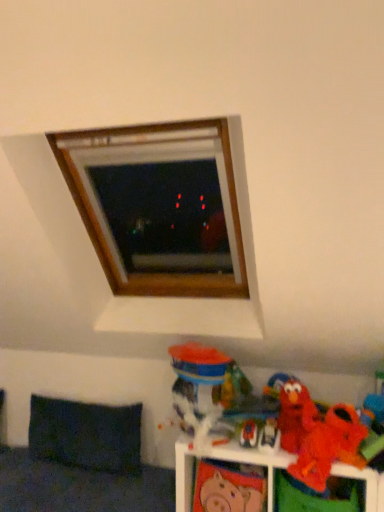
Question: Can you confirm if orange plush toy at lower right, marked as the 1th toy in a right-to-left arrangement, is positioned to the left of matte pink piggy bank at lower center, the sixth toy in the right-to-left sequence?

Choices:
 (A) no
 (B) yes

Answer: (A)

Question: Is orange plush toy at lower right, marked as the 1th toy in a right-to-left arrangement, positioned with its back to matte pink piggy bank at lower center, the sixth toy in the right-to-left sequence?

Choices:
 (A) no
 (B) yes

Answer: (A)

Question: From the image's perspective, is orange plush toy at lower right, placed as the 7th toy when sorted from left to right, under matte pink piggy bank at lower center, acting as the second toy starting from the left?

Choices:
 (A) no
 (B) yes

Answer: (A)

Question: Is orange plush toy at lower right, placed as the 7th toy when sorted from left to right, behind matte pink piggy bank at lower center, acting as the second toy starting from the left?

Choices:
 (A) yes
 (B) no

Answer: (B)

Question: Is orange plush toy at lower right, placed as the 7th toy when sorted from left to right, not inside matte pink piggy bank at lower center, acting as the second toy starting from the left?

Choices:
 (A) no
 (B) yes

Answer: (B)

Question: Is dark fabric pillow at lower left taller or shorter than matte plastic toy at lower right, the 5th toy from the right?

Choices:
 (A) tall
 (B) short

Answer: (A)

Question: Visually, is dark fabric pillow at lower left positioned to the left or to the right of matte plastic toy at lower right, the 5th toy from the right?

Choices:
 (A) right
 (B) left

Answer: (B)

Question: Considering their positions, is dark fabric pillow at lower left located in front of or behind matte plastic toy at lower right, the 5th toy from the right?

Choices:
 (A) front
 (B) behind

Answer: (B)

Question: Considering the positions of point (61, 413) and point (241, 441), is point (61, 413) closer or farther from the camera than point (241, 441)?

Choices:
 (A) closer
 (B) farther

Answer: (B)

Question: In terms of height, does matte plastic toy at lower right, which is the third toy from left to right, look taller or shorter compared to matte plastic elmo at lower right, marked as the 4th toy in a right-to-left arrangement?

Choices:
 (A) tall
 (B) short

Answer: (B)

Question: Relative to matte plastic elmo at lower right, the fourth toy positioned from the left, is matte plastic toy at lower right, which is the third toy from left to right, in front or behind?

Choices:
 (A) behind
 (B) front

Answer: (A)

Question: In the image, is matte plastic toy at lower right, the 5th toy from the right, on the left side or the right side of matte plastic elmo at lower right, marked as the 4th toy in a right-to-left arrangement?

Choices:
 (A) right
 (B) left

Answer: (B)

Question: Is matte plastic toy at lower right, the 5th toy from the right, inside the boundaries of matte plastic elmo at lower right, marked as the 4th toy in a right-to-left arrangement, or outside?

Choices:
 (A) inside
 (B) outside

Answer: (B)

Question: Is point (236, 498) closer or farther from the camera than point (375, 422)?

Choices:
 (A) closer
 (B) farther

Answer: (B)

Question: Considering their positions, is matte pink piggy bank at lower center, the sixth toy in the right-to-left sequence, located in front of or behind orange plush toy at lower right, marked as the 1th toy in a right-to-left arrangement?

Choices:
 (A) front
 (B) behind

Answer: (B)